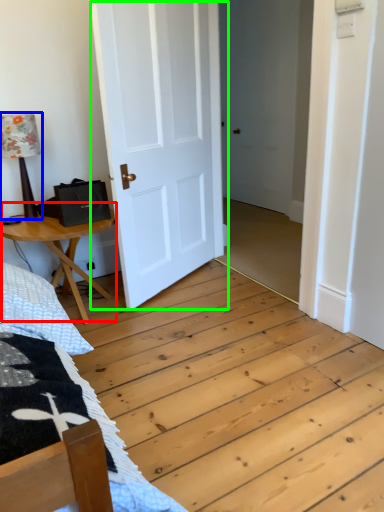
Question: Based on their relative distances, which object is farther from table (highlighted by a red box)? Choose from table lamp (highlighted by a blue box) and door (highlighted by a green box).

Choices:
 (A) table lamp
 (B) door

Answer: (B)